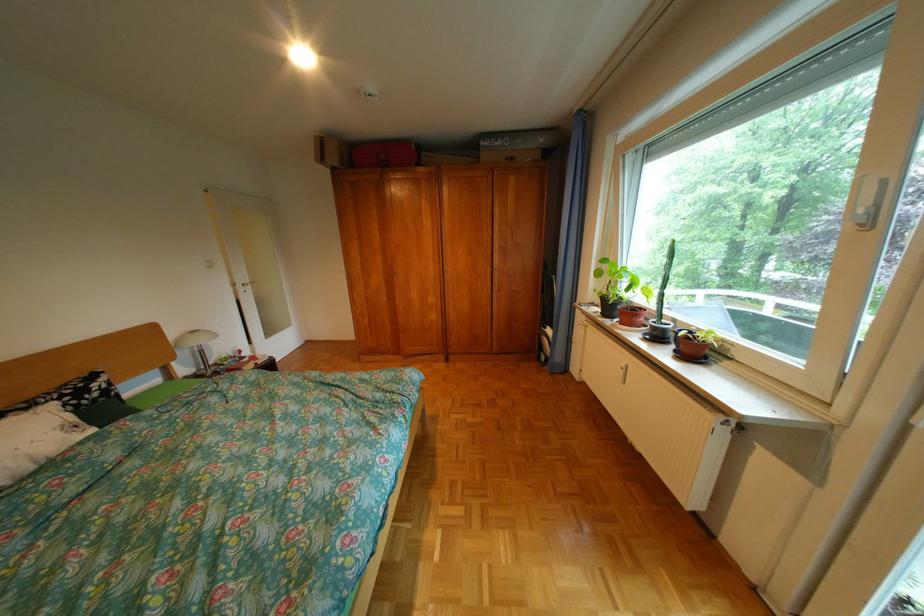
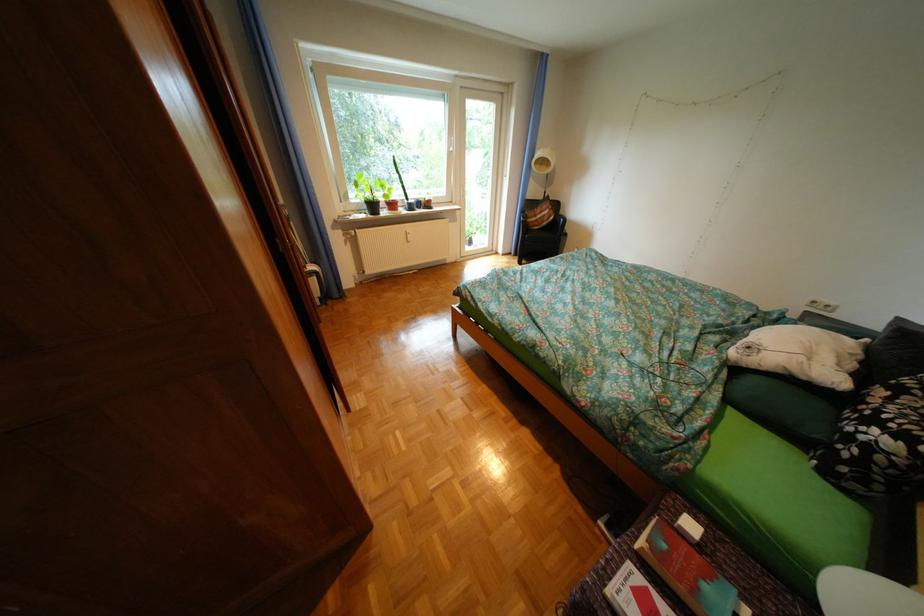
In the second image, find the point that corresponds to [40,408] in the first image.

(904, 399)